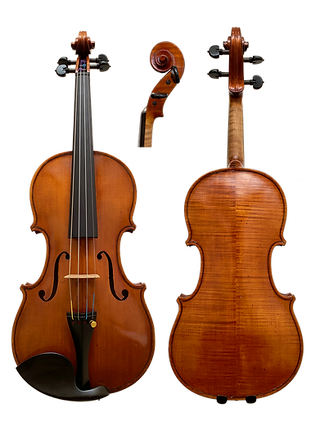
Locate an element on the screen. The width and height of the screenshot is (320, 430). handle is located at coordinates (175, 53).